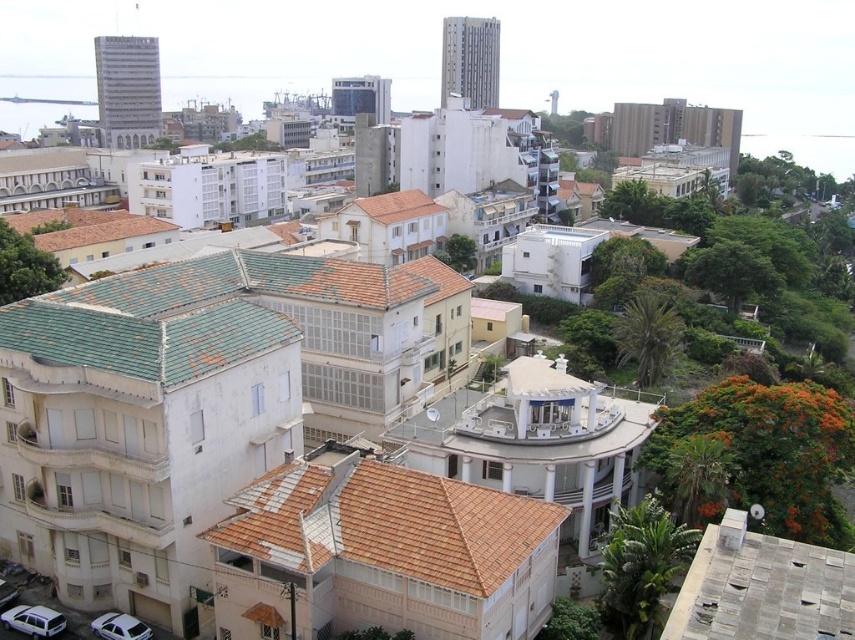
Based on the photo, is white matte station wagon at lower left smaller than white glossy car at lower left?

Yes.

Between point (1, 620) and point (146, 632), which one is positioned in front?

Point (146, 632) is in front.

The height and width of the screenshot is (640, 855). Find the location of `white matte station wagon at lower left`. white matte station wagon at lower left is located at coordinates (34, 620).